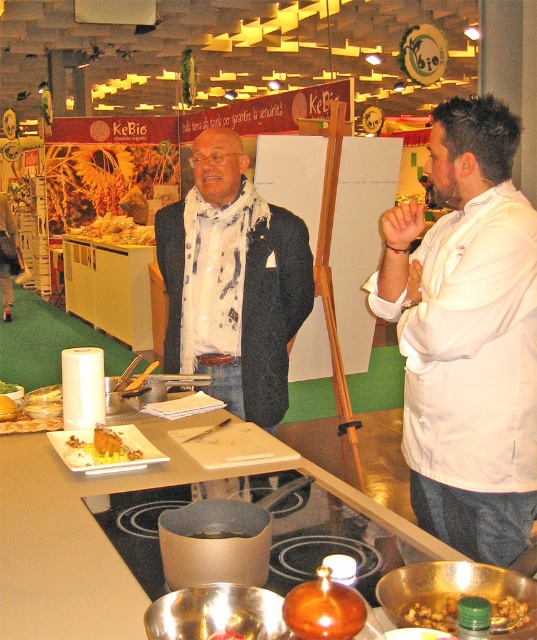
Does brown matte nuts at lower right have a larger size compared to golden crispy pastry at center?

No, brown matte nuts at lower right is not bigger than golden crispy pastry at center.

Between point (442, 596) and point (148, 234), which one is positioned in front?

Point (442, 596) is in front.

You are a GUI agent. You are given a task and a screenshot of the screen. Output one action in this format:
    pyautogui.click(x=<x>, y=<y>)
    Task: Click on the brown matte nuts at lower right
    Image resolution: width=537 pixels, height=640 pixels.
    Given the screenshot: What is the action you would take?
    pyautogui.click(x=431, y=612)

Is white chef coat at right positioned behind dark gray woolen jacket at center?

That is False.

What do you see at coordinates (468, 336) in the screenshot? I see `white chef coat at right` at bounding box center [468, 336].

This screenshot has width=537, height=640. I want to click on white chef coat at right, so click(x=468, y=336).

Does brown matte nuts at lower right appear under golden brown bread at center?

Correct, brown matte nuts at lower right is located below golden brown bread at center.

Measure the distance between point (x=410, y=620) and camera.

Point (x=410, y=620) is 94.43 centimeters from camera.

Does point (495, 621) lie behind point (2, 401)?

No, it is not.

Identify the location of brown matte nuts at lower right. (431, 612).